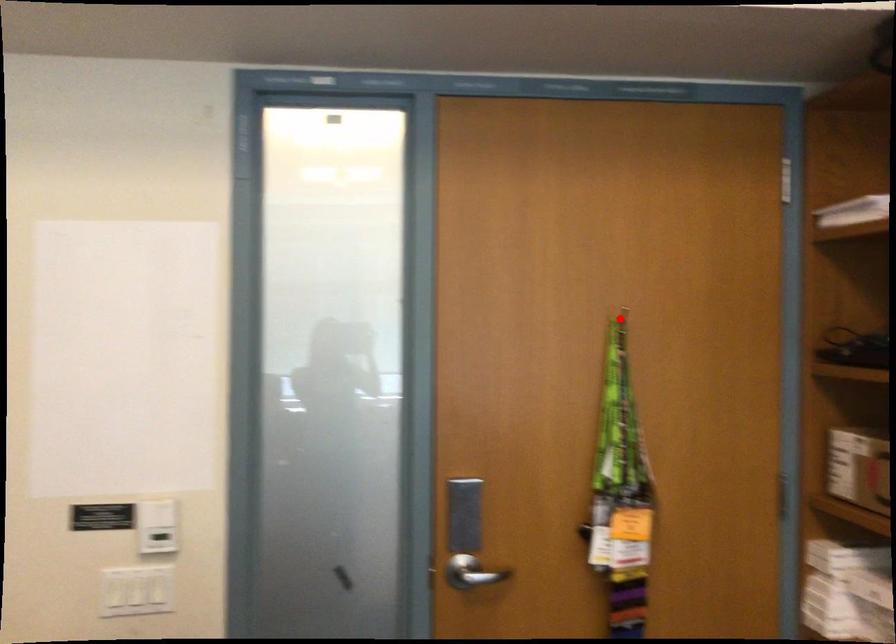
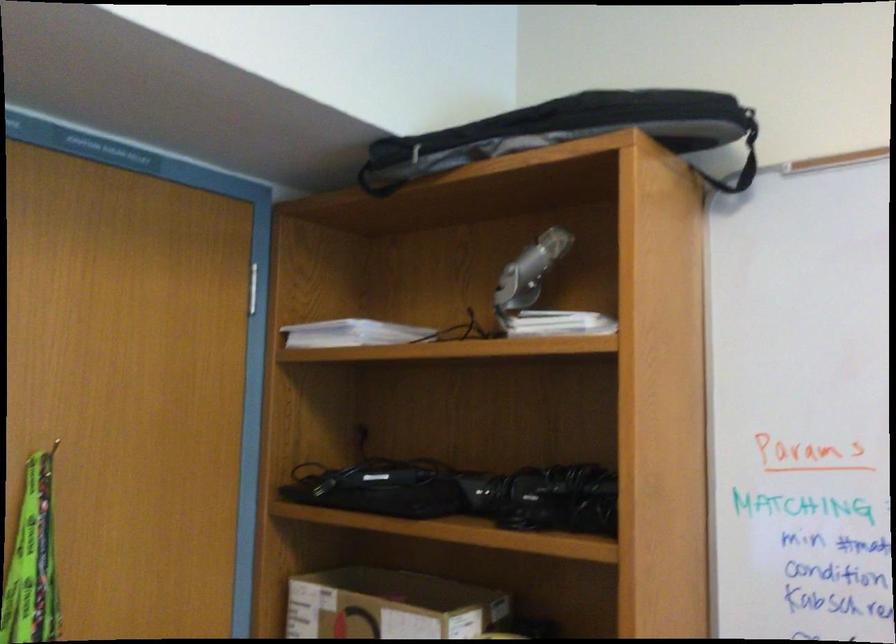
Question: I am providing you with two images of the same scene from different viewpoints. A red point is shown in image1. For the corresponding object point in image2, is it positioned nearer or farther from the camera?

Choices:
 (A) Nearer
 (B) Farther

Answer: (A)